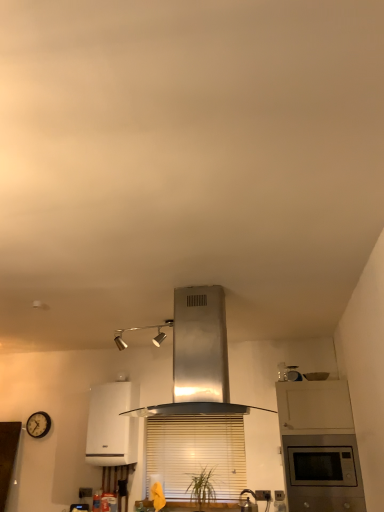
Question: Are wooden blinds at center and wooden clock at lower left far apart?

Choices:
 (A) yes
 (B) no

Answer: (A)

Question: From the image's perspective, would you say wooden blinds at center is shown under wooden clock at lower left?

Choices:
 (A) no
 (B) yes

Answer: (B)

Question: Does wooden blinds at center appear on the left side of wooden clock at lower left?

Choices:
 (A) no
 (B) yes

Answer: (A)

Question: From a real-world perspective, is wooden blinds at center beneath wooden clock at lower left?

Choices:
 (A) yes
 (B) no

Answer: (A)

Question: From the image's perspective, would you say wooden blinds at center is positioned over wooden clock at lower left?

Choices:
 (A) yes
 (B) no

Answer: (B)

Question: Is point (100, 462) closer or farther from the camera than point (205, 373)?

Choices:
 (A) closer
 (B) farther

Answer: (B)

Question: From the image's perspective, is white glossy boiler at center, the first home appliance in the bottom-to-top sequence, above or below stainless steel range hood at center, the second home appliance in the bottom-to-top sequence?

Choices:
 (A) above
 (B) below

Answer: (B)

Question: Considering the positions of white glossy boiler at center, the 1th home appliance when ordered from left to right, and stainless steel range hood at center, which appears as the first home appliance when viewed from the top, in the image, is white glossy boiler at center, the 1th home appliance when ordered from left to right, wider or thinner than stainless steel range hood at center, which appears as the first home appliance when viewed from the top,?

Choices:
 (A) wide
 (B) thin

Answer: (B)

Question: From a real-world perspective, is white glossy boiler at center, the 1th home appliance in the back-to-front sequence, positioned above or below stainless steel range hood at center, which is counted as the first home appliance, starting from the front?

Choices:
 (A) above
 (B) below

Answer: (B)

Question: From the image's perspective, is wooden blinds at center positioned above or below satin white cabinet at right?

Choices:
 (A) above
 (B) below

Answer: (B)

Question: Is wooden blinds at center in front of or behind satin white cabinet at right in the image?

Choices:
 (A) behind
 (B) front

Answer: (A)

Question: Would you say wooden blinds at center is inside or outside satin white cabinet at right?

Choices:
 (A) outside
 (B) inside

Answer: (A)

Question: Would you say wooden blinds at center is to the left or to the right of satin white cabinet at right in the picture?

Choices:
 (A) left
 (B) right

Answer: (A)

Question: Is satin silver kettle at lower center in front of or behind wooden blinds at center in the image?

Choices:
 (A) behind
 (B) front

Answer: (B)

Question: Would you say satin silver kettle at lower center is inside or outside wooden blinds at center?

Choices:
 (A) inside
 (B) outside

Answer: (B)